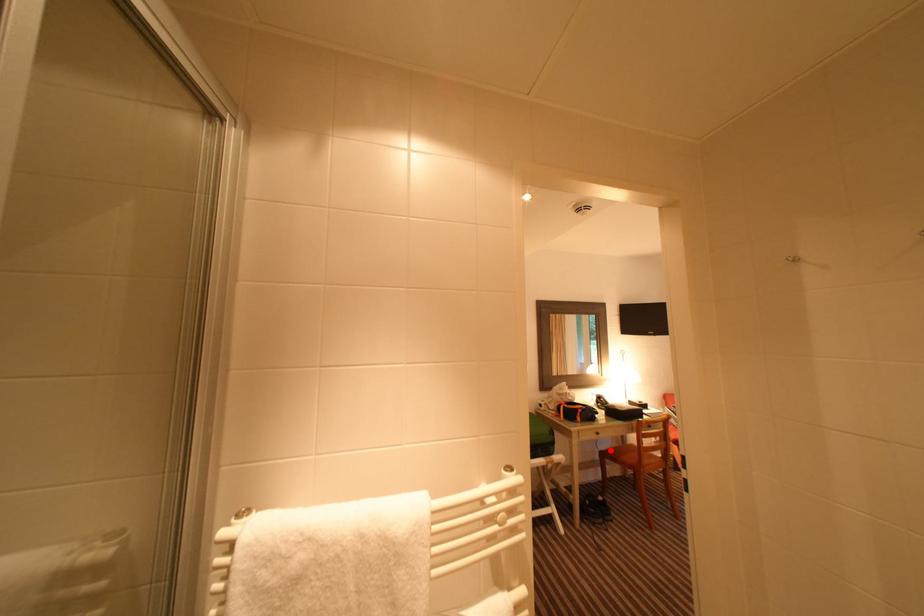
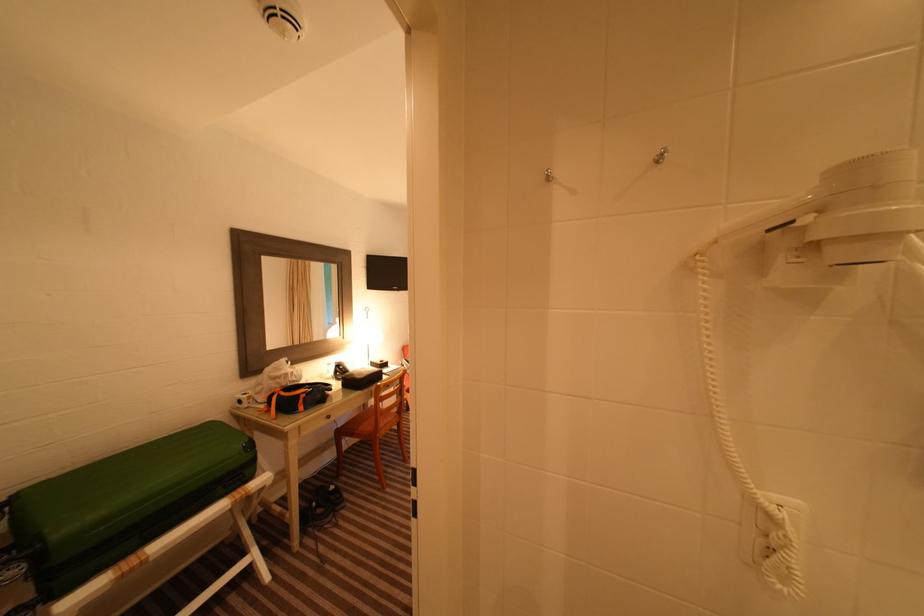
Question: I am providing you with two images of the same scene from different viewpoints. A red point is shown in image1. For the corresponding object point in image2, is it positioned nearer or farther from the camera?

Choices:
 (A) Nearer
 (B) Farther

Answer: (A)